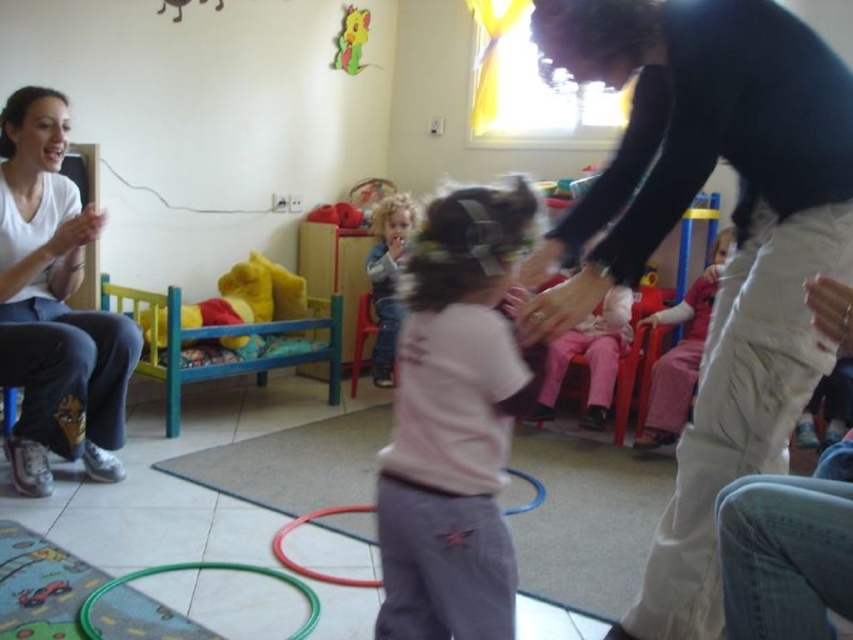
Consider the image. You are standing at the point labeled as point (x=28, y=120) in the playroom. You want to move to the window with yellow curtains. Can you walk straight ahead from your current position to reach the window?

The point labeled as point (x=28, y=120) is 8.27 feet away from the viewer. Since the viewer is facing the window with yellow curtains, you can walk straight ahead from the point (x=28, y=120) to reach the window.

You are standing in the playroom and need to find the white cotton shirt at left. According to the coordinates provided, where exactly should you look?

The white cotton shirt at left is located at point (54, 305), so you should look there.

You are a photographer trying to capture a clear photo of the pink cotton shirt at center and the green plastic hoop at lower center. Which object should you focus on first if you want to ensure both are in focus, considering their sizes?

The pink cotton shirt at center is larger in size than the green plastic hoop at lower center, so you should focus on the pink cotton shirt at center first to ensure both are in focus.